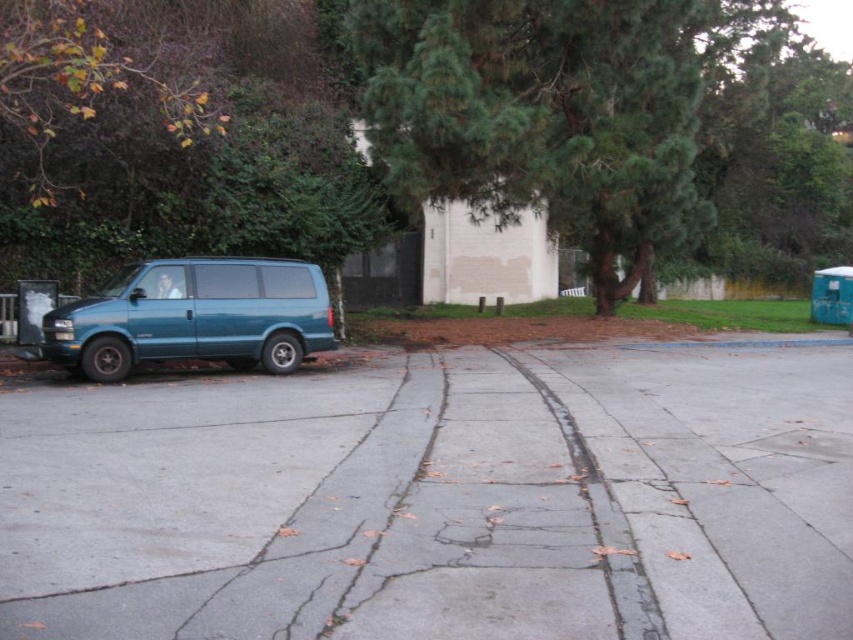
Question: Does green leafy tree at upper center appear on the right side of teal matte van at left?

Choices:
 (A) yes
 (B) no

Answer: (A)

Question: Which point is farther to the camera?

Choices:
 (A) green leafy tree at upper center
 (B) gray concrete pavement at center

Answer: (A)

Question: Which object is farther from the camera taking this photo?

Choices:
 (A) green leafy tree at upper center
 (B) gray concrete pavement at center
 (C) teal matte van at left

Answer: (A)

Question: Considering the relative positions of green leafy tree at upper center and teal matte van at left in the image provided, where is green leafy tree at upper center located with respect to teal matte van at left?

Choices:
 (A) right
 (B) left

Answer: (A)

Question: Among these objects, which one is farthest from the camera?

Choices:
 (A) teal matte van at left
 (B) gray concrete pavement at center

Answer: (A)

Question: Considering the relative positions of green leafy tree at upper center and teal matte van at left in the image provided, where is green leafy tree at upper center located with respect to teal matte van at left?

Choices:
 (A) left
 (B) right

Answer: (B)